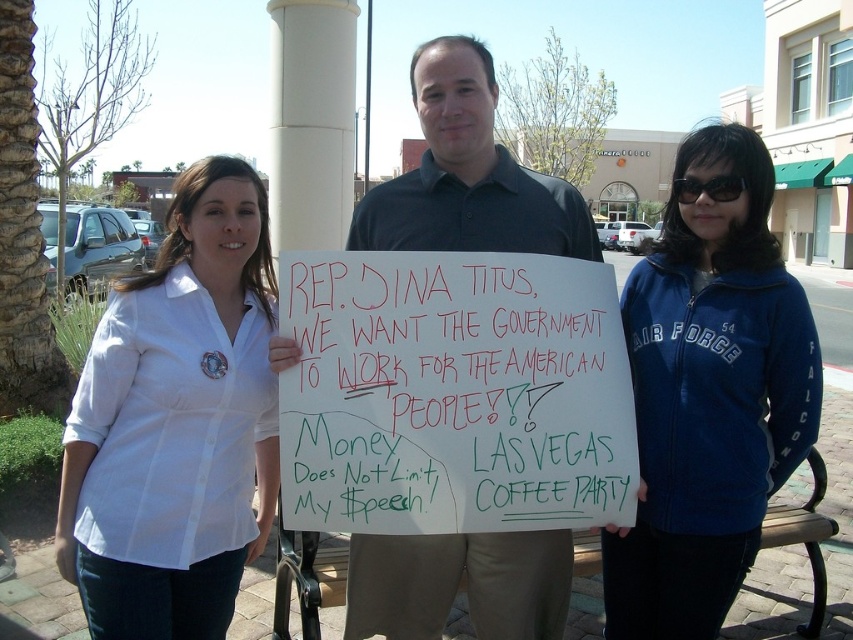
Question: Which object is farther from the camera taking this photo?

Choices:
 (A) white button-down shirt at left
 (B) blue fleece jacket at center

Answer: (B)

Question: Is white button-down shirt at left positioned behind dark gray shirt at center?

Choices:
 (A) no
 (B) yes

Answer: (A)

Question: Does blue fleece jacket at center appear over dark gray shirt at center?

Choices:
 (A) no
 (B) yes

Answer: (A)

Question: Which object is the farthest from the white button-down shirt at left?

Choices:
 (A) handwritten sign at center
 (B) dark gray shirt at center
 (C) blue fleece jacket at center

Answer: (C)

Question: Based on their relative distances, which object is nearer to the blue fleece jacket at center?

Choices:
 (A) handwritten sign at center
 (B) dark gray shirt at center

Answer: (A)

Question: Can you confirm if handwritten sign at center is positioned to the right of dark gray shirt at center?

Choices:
 (A) no
 (B) yes

Answer: (B)